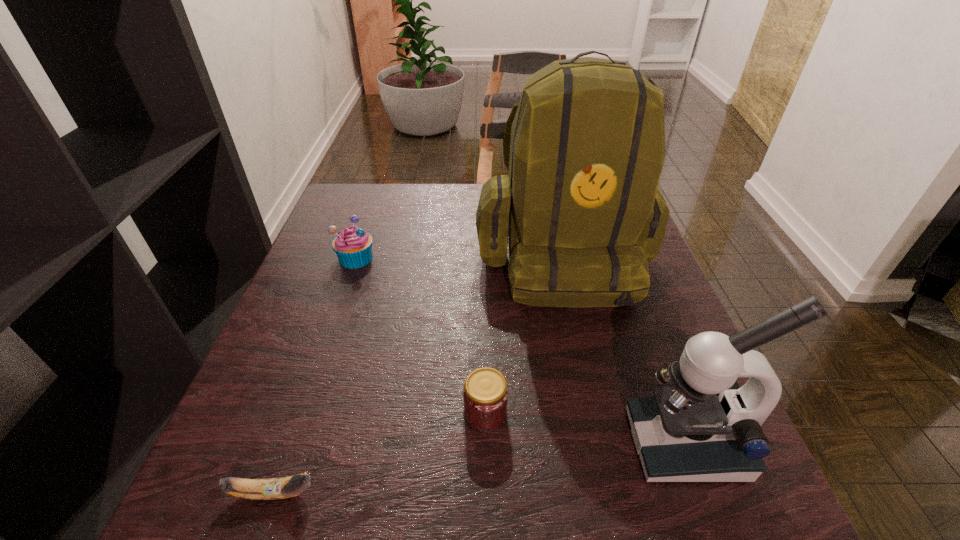
The width and height of the screenshot is (960, 540). I want to click on vacant space at the far edge of the desktop, so click(x=415, y=186).

Where is `blank space at the near edge of the desktop`? Image resolution: width=960 pixels, height=540 pixels. blank space at the near edge of the desktop is located at coordinates (439, 497).

Locate an element on the screen. vacant area at the left edge is located at coordinates (324, 256).

Find the location of `vacant area at the far left corner of the desktop`. vacant area at the far left corner of the desktop is located at coordinates (347, 226).

Where is `vacant space at the near right corner`? This screenshot has height=540, width=960. vacant space at the near right corner is located at coordinates (761, 497).

You are a GUI agent. You are given a task and a screenshot of the screen. Output one action in this format:
    pyautogui.click(x=<x>, y=<y>)
    Task: Click on the vacant area that lies between the third tallest object and the microscope
    The width and height of the screenshot is (960, 540).
    Given the screenshot: What is the action you would take?
    pyautogui.click(x=520, y=350)

Find the location of a particular element. Image resolution: width=960 pixels, height=540 pixels. vacant area that lies between the backpack and the fourth shortest object is located at coordinates (623, 349).

Locate an element on the screen. empty space between the backpack and the third shortest object is located at coordinates (459, 256).

Locate an element on the screen. Image resolution: width=960 pixels, height=540 pixels. empty location between the backpack and the banana is located at coordinates pos(418,374).

Locate an element on the screen. Image resolution: width=960 pixels, height=540 pixels. empty location between the muffin and the banana is located at coordinates (315, 375).